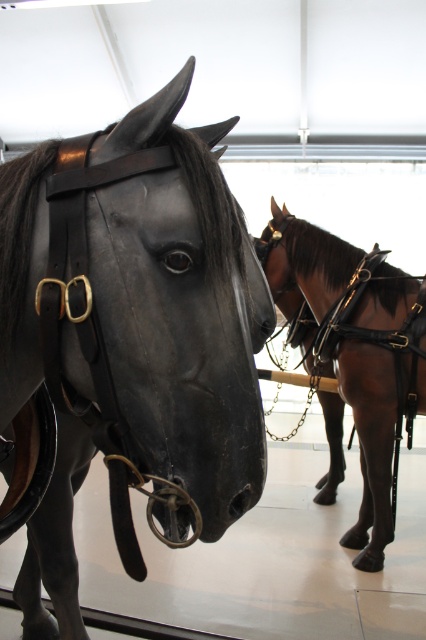
Question: Which point appears closest to the camera in this image?

Choices:
 (A) (357, 275)
 (B) (144, 326)

Answer: (B)

Question: Is black polished wood horse at center below brown glossy horse at center?

Choices:
 (A) no
 (B) yes

Answer: (A)

Question: Which of the following is the farthest from the observer?

Choices:
 (A) (359, 449)
 (B) (244, 456)

Answer: (A)

Question: From the image, what is the correct spatial relationship of black polished wood horse at center in relation to brown glossy horse at center?

Choices:
 (A) above
 (B) below

Answer: (A)

Question: Does black polished wood horse at center have a larger size compared to brown glossy horse at center?

Choices:
 (A) no
 (B) yes

Answer: (A)